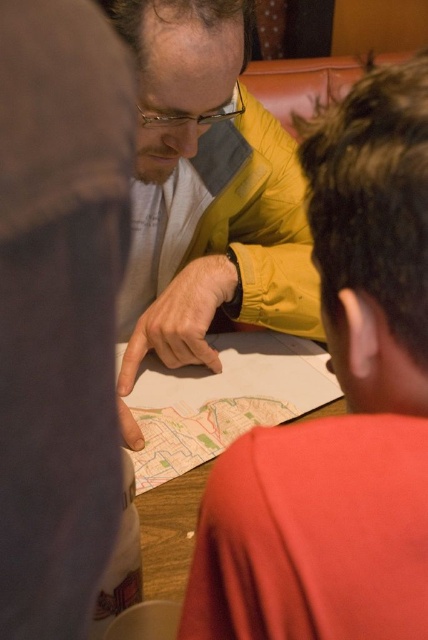
Question: Which of the following is the farthest from the observer?

Choices:
 (A) yellow matte jacket at center
 (B) matte yellow jacket at upper center
 (C) wooden table at center
 (D) white cotton shirt at center

Answer: (D)

Question: Which point is closer to the camera?

Choices:
 (A) matte yellow jacket at upper center
 (B) white cotton shirt at center
 (C) wooden table at center

Answer: (A)

Question: Is yellow matte jacket at center thinner than wooden table at center?

Choices:
 (A) yes
 (B) no

Answer: (B)

Question: Which point appears closest to the camera in this image?

Choices:
 (A) (293, 518)
 (B) (187, 465)
 (C) (184, 195)
 (D) (177, 12)

Answer: (A)

Question: Where is yellow matte jacket at center located in relation to white cotton shirt at center in the image?

Choices:
 (A) above
 (B) below

Answer: (A)

Question: Does yellow matte jacket at center have a smaller size compared to wooden table at center?

Choices:
 (A) no
 (B) yes

Answer: (A)